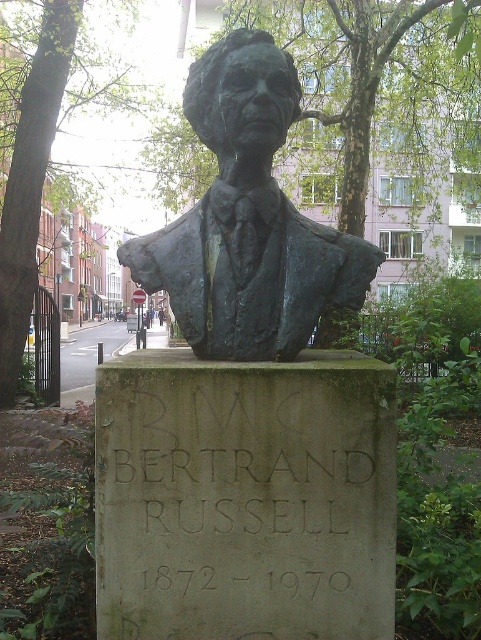
You are an art conservator assessing the bronze statue at center and the graycarved stonebust at center. Which object would require more frequent maintenance due to its material and exposure to the elements?

The bronze statue at center requires more frequent maintenance because bronze is more susceptible to weathering and corrosion compared to stone, especially since it is larger in size than the graycarved stonebust at center, which may reduce its durability over time.

You are standing in front of a statue of Bertrand Russell. The statue is represented by the point at coordinates point (248, 220). If you were to walk directly towards the statue, which direction should you move from your current position?

The bronze statue at center is represented by point (248, 220). Since the statue is at the center of the image, you should move forward towards the center to reach it.